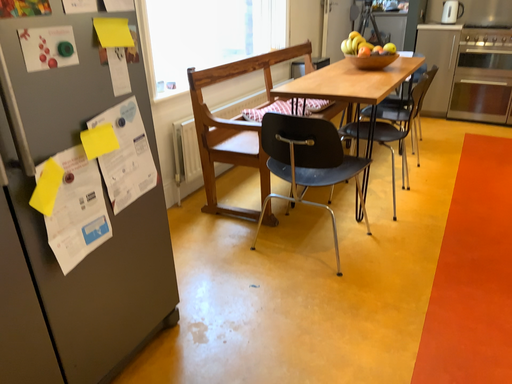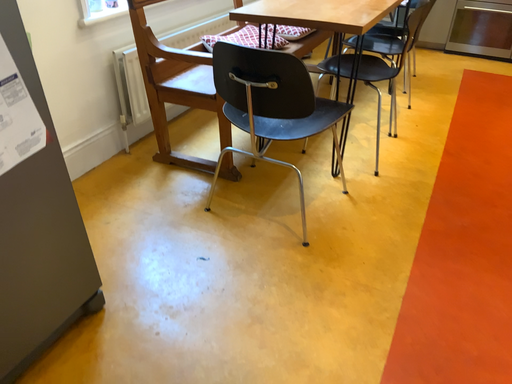
Question: Which way did the camera rotate in the video?

Choices:
 (A) rotated upward
 (B) rotated downward

Answer: (B)